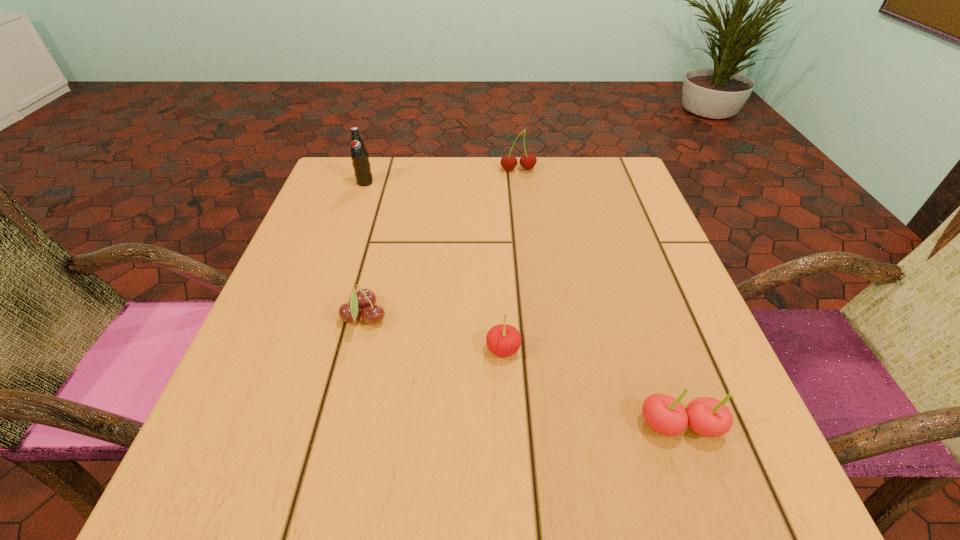
Image resolution: width=960 pixels, height=540 pixels. What are the coordinates of `the second farthest object` in the screenshot? It's located at (360, 159).

Where is `the tallest object`? The width and height of the screenshot is (960, 540). the tallest object is located at coordinates (360, 159).

I want to click on the farthest object, so click(508, 162).

Find the location of a particular element. the nearest cherry is located at coordinates (706, 416).

The width and height of the screenshot is (960, 540). I want to click on the rightmost cherry, so click(706, 416).

Where is `the leftmost cherry`? The width and height of the screenshot is (960, 540). the leftmost cherry is located at coordinates (365, 299).

Where is `the second object from left to right`? Image resolution: width=960 pixels, height=540 pixels. the second object from left to right is located at coordinates (365, 299).

Identify the location of vacant area situated on the front label of the tallest object. Image resolution: width=960 pixels, height=540 pixels. (350, 225).

Where is `blank area located 0.220m on the surface of the farthest cherry`? The height and width of the screenshot is (540, 960). blank area located 0.220m on the surface of the farthest cherry is located at coordinates (525, 228).

Image resolution: width=960 pixels, height=540 pixels. I want to click on free point located on the left of the rightmost cherry, so click(485, 426).